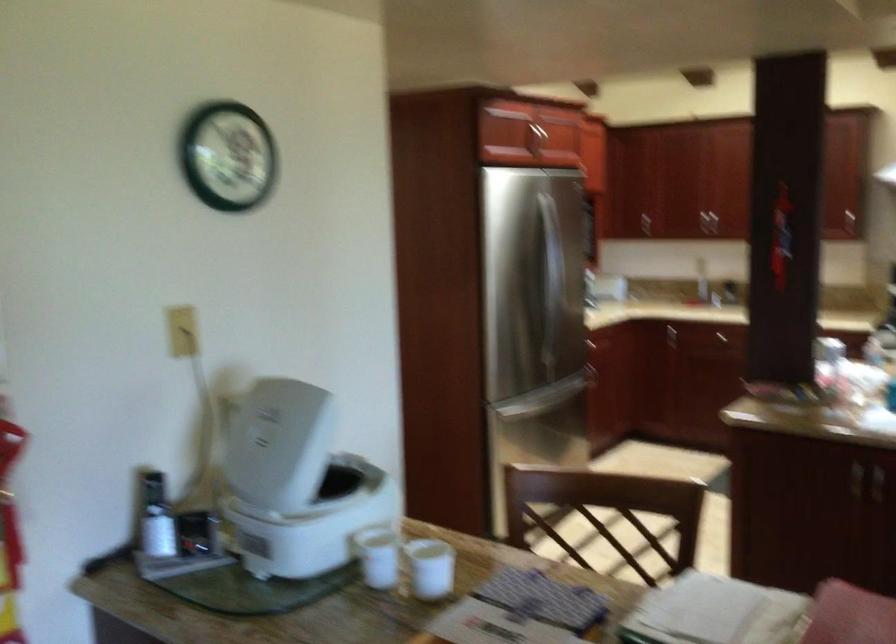
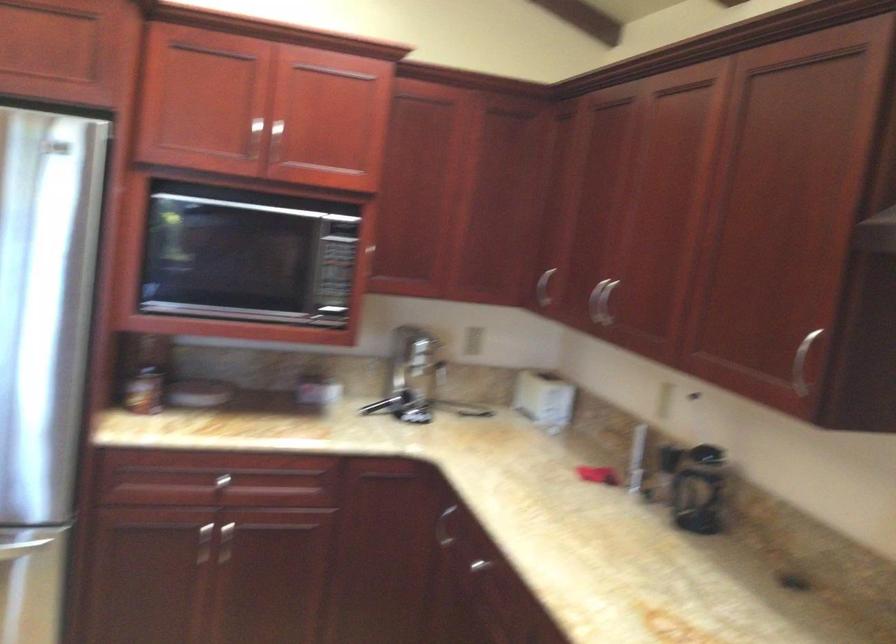
Where in the second image is the point corresponding to the point at 649,321 from the first image?

(444, 527)